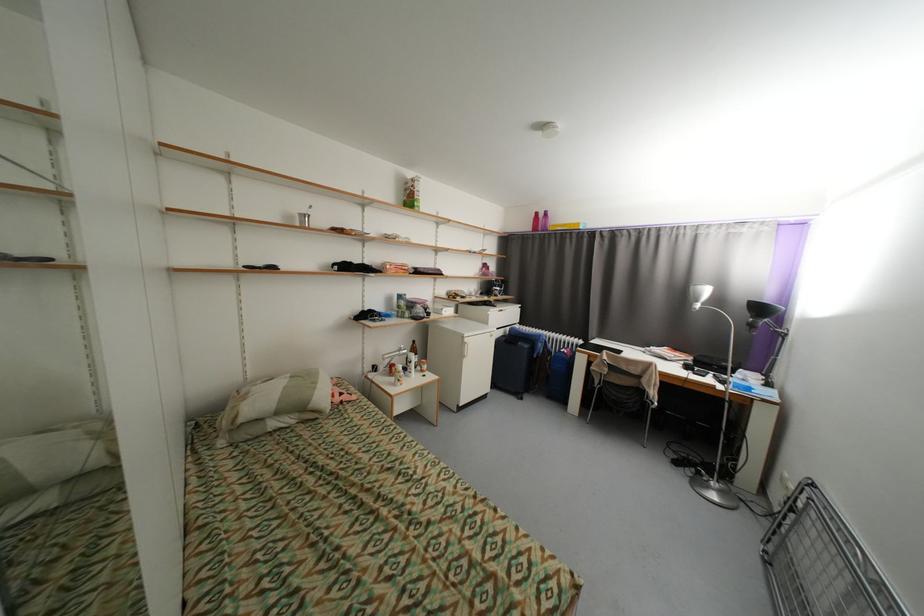
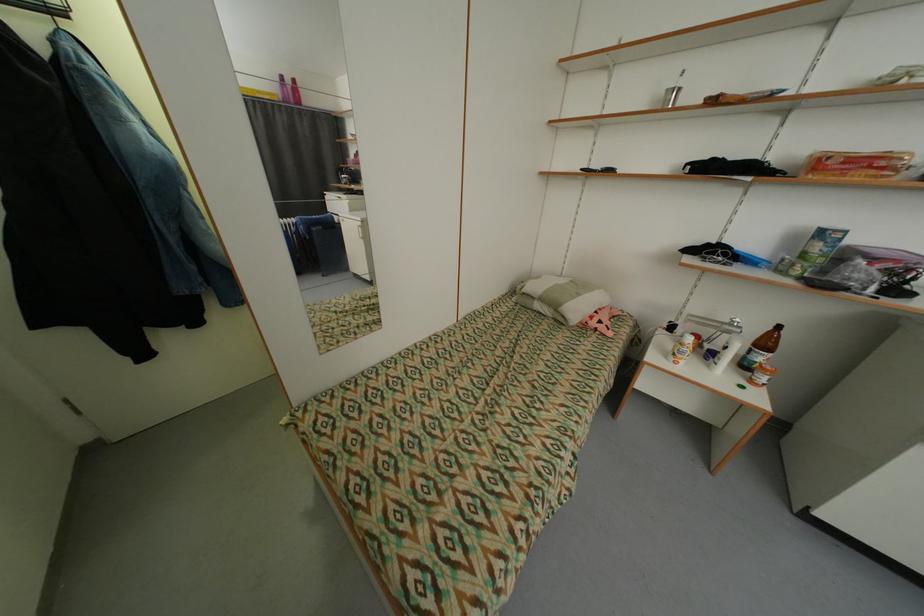
The point at (344, 400) is marked in the first image. Where is the corresponding point in the second image?

(600, 323)